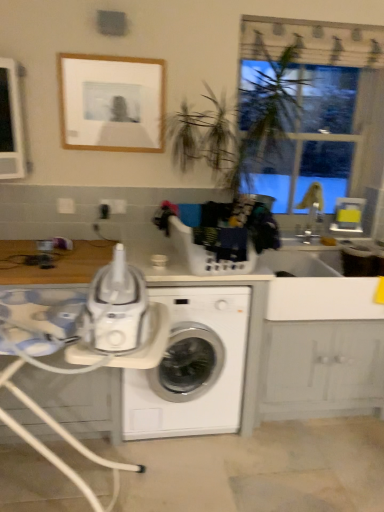
Identify the location of free point below white plastic table at lower left (from a real-world perspective). (94, 490).